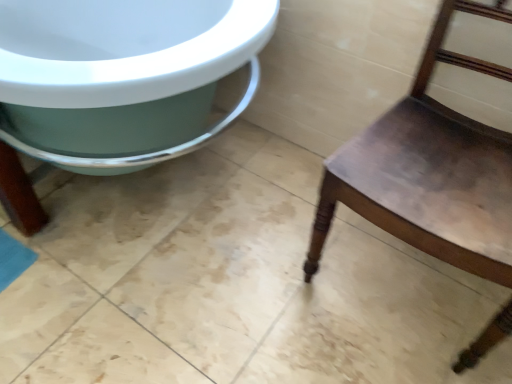
Describe the element at coordinates (430, 170) in the screenshot. I see `wooden chair at right` at that location.

The image size is (512, 384). In order to click on wooden chair at right in this screenshot , I will do `click(430, 170)`.

The width and height of the screenshot is (512, 384). I want to click on wooden chair at right, so click(430, 170).